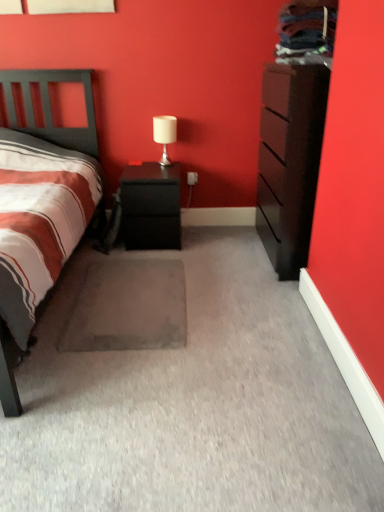
Locate an element on the screen. This screenshot has height=512, width=384. free location in front of gray carpet at center is located at coordinates (135, 394).